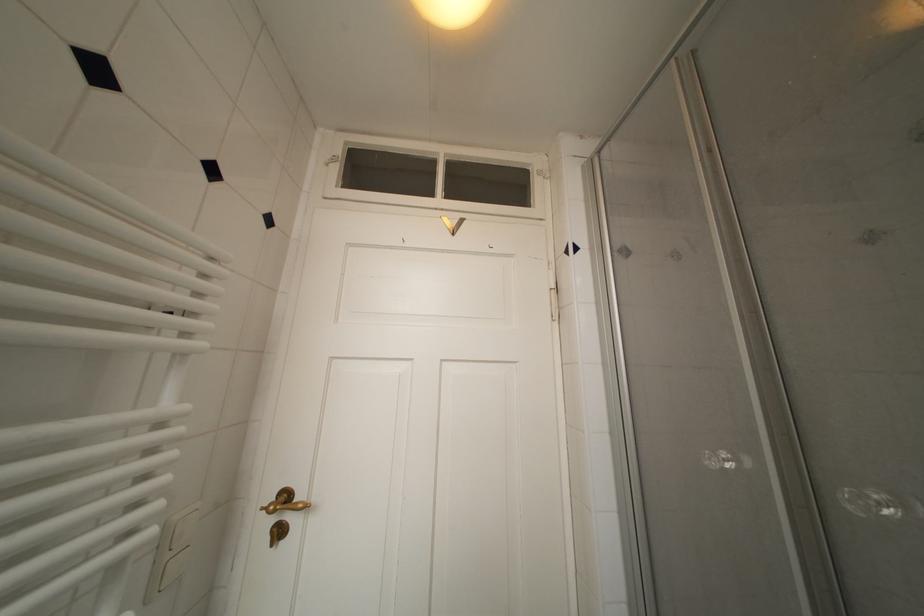
Locate an element on the screen. shower door handle is located at coordinates (285, 501).